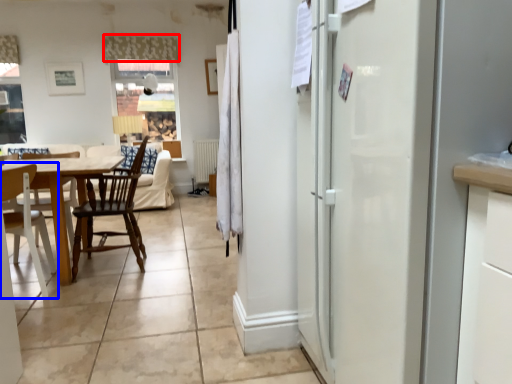
Question: Which object appears farthest to the camera in this image, curtain (highlighted by a red box) or chair (highlighted by a blue box)?

Choices:
 (A) curtain
 (B) chair

Answer: (A)